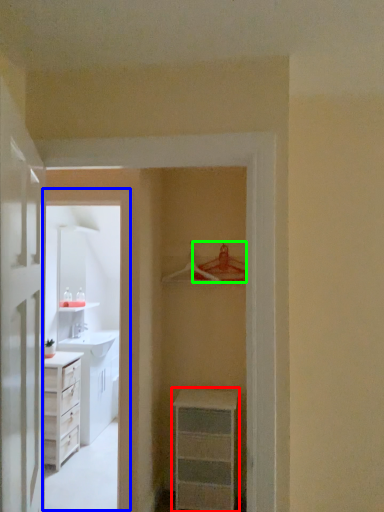
Question: Estimate the real-world distances between objects in this image. Which object is closer to chest of drawers (highlighted by a red box), corridor (highlighted by a blue box) or hanger (highlighted by a green box)?

Choices:
 (A) corridor
 (B) hanger

Answer: (A)